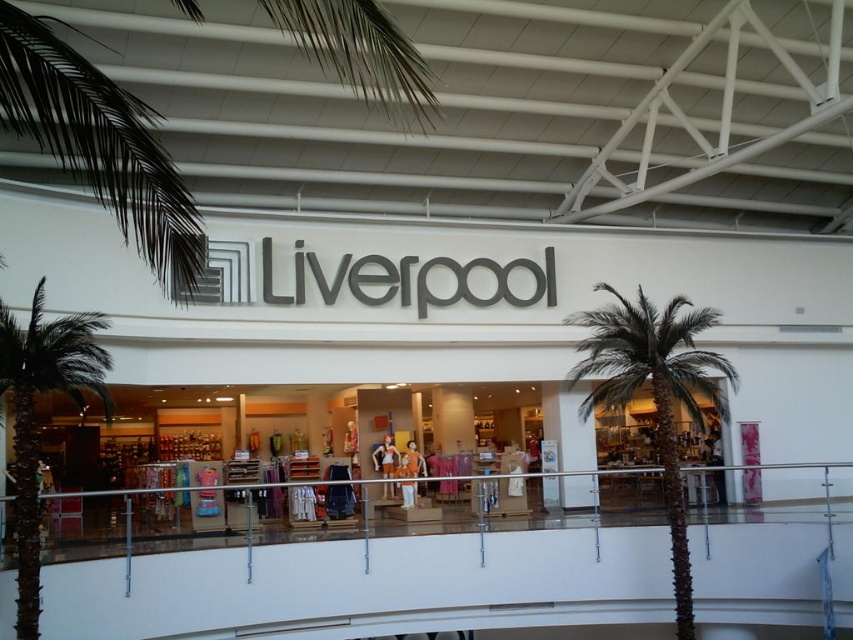
Question: Which point is farther to the camera?

Choices:
 (A) green leafy palm tree at left
 (B) brown textured palm tree at center

Answer: (B)

Question: Is brown textured palm tree at center further to camera compared to green leafy palm tree at left?

Choices:
 (A) yes
 (B) no

Answer: (A)

Question: Among these objects, which one is nearest to the camera?

Choices:
 (A) brown textured palm tree at center
 (B) green leafy palm tree at left

Answer: (B)

Question: Can you confirm if brown textured palm tree at center is positioned below green leafy palm tree at left?

Choices:
 (A) yes
 (B) no

Answer: (A)

Question: Does brown textured palm tree at center have a smaller size compared to green leafy palm tree at left?

Choices:
 (A) yes
 (B) no

Answer: (A)